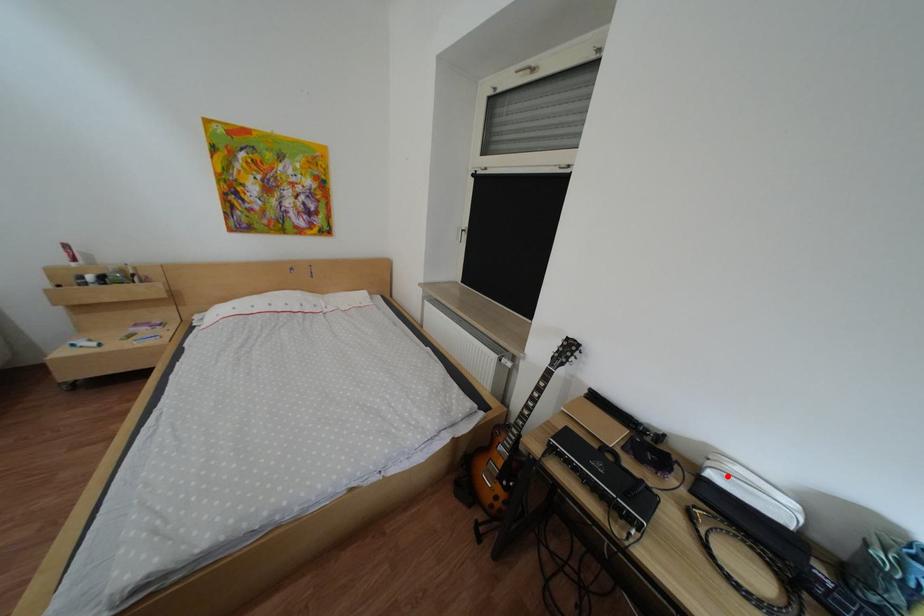
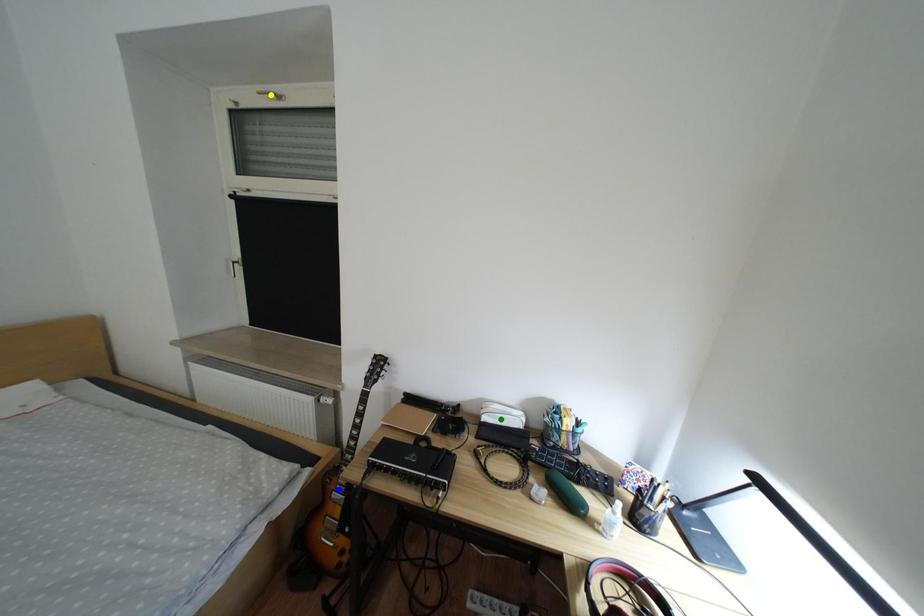
Question: I am providing you with two images of the same scene from different viewpoints. A red point is marked on the first image. You are given multiple points on the second image. Which mark in image 2 goes with the point in image 1?

Choices:
 (A) green point
 (B) yellow point
 (C) blue point

Answer: (A)